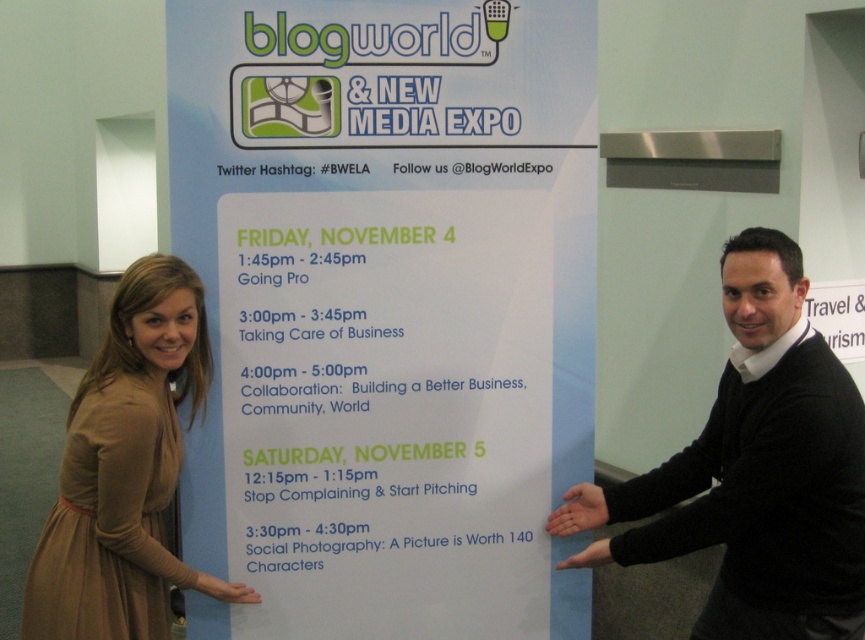
You are at the Blogworld event and see the black sweater at right. Where exactly is it positioned on the banner?

The black sweater at right is located at point (755,470) on the banner.

You are at the Blogworld event and need to find the white paper poster at center. According to the banner, which day and time is the session related to this poster?

The white paper poster at center is located at point (388, 308) on the banner, which corresponds to the Friday, November 4th session.

You are standing in front of the promotional banner for Blogworld and New Media Expo. You see a point at coordinate (388, 308). Is this point located on the white paper poster at center?

Yes, the point at coordinate (388, 308) is located on the white paper poster at center.